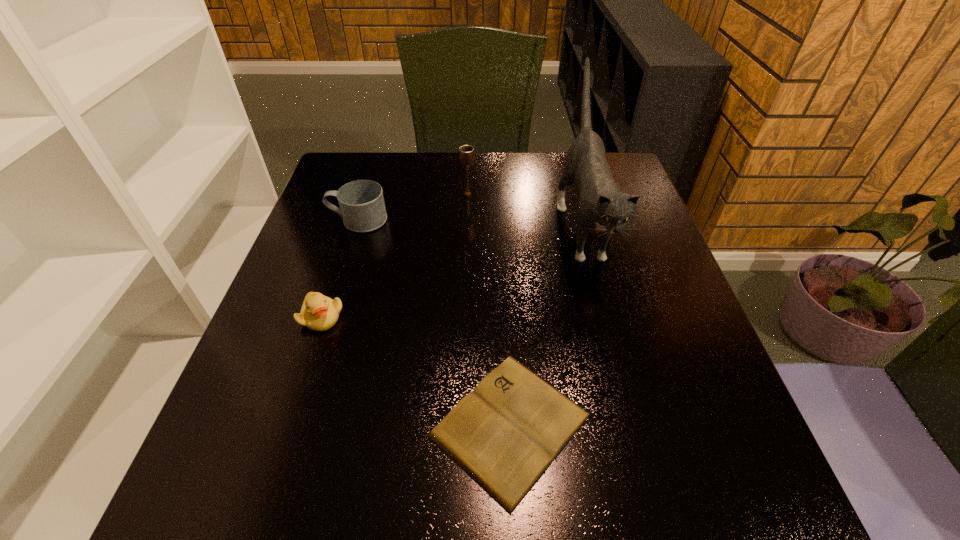
In the image, there is a desktop. What are the coordinates of `vacant space at the near edge` in the screenshot? It's located at (475, 519).

Where is `blank space at the left edge of the desktop`? blank space at the left edge of the desktop is located at coordinates [350, 301].

Image resolution: width=960 pixels, height=540 pixels. In the image, there is a desktop. Find the location of `blank space at the right edge`. blank space at the right edge is located at coordinates (632, 326).

In the image, there is a desktop. At what (x,y) coordinates should I click in order to perform the action: click on vacant space at the near left corner. Please return your answer as a coordinate pair (x, y). The width and height of the screenshot is (960, 540). Looking at the image, I should click on (290, 469).

Find the location of `vacant region at the near right corner of the desktop`. vacant region at the near right corner of the desktop is located at coordinates (737, 504).

At what (x,y) coordinates should I click in order to perform the action: click on empty location between the duckling and the nearest object. Please return your answer as a coordinate pair (x, y). This screenshot has height=540, width=960. Looking at the image, I should click on (416, 371).

At what (x,y) coordinates should I click in order to perform the action: click on vacant region between the fourth shortest object and the duckling. Please return your answer as a coordinate pair (x, y). The width and height of the screenshot is (960, 540). Looking at the image, I should click on (395, 255).

This screenshot has height=540, width=960. Find the location of `free point between the shortest object and the chalice`. free point between the shortest object and the chalice is located at coordinates (489, 309).

In order to click on vacant space in between the chalice and the nearest object in this screenshot , I will do (489, 309).

Image resolution: width=960 pixels, height=540 pixels. Identify the location of free space between the chalice and the mug. (413, 207).